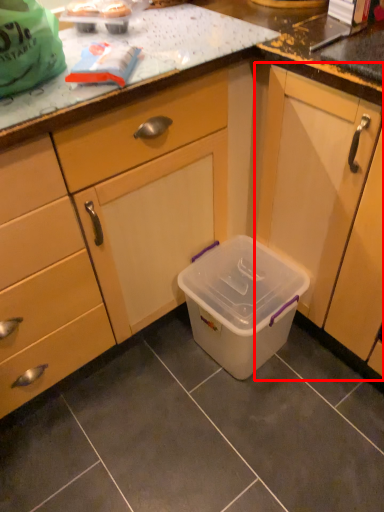
Question: From the image's perspective, what is the correct spatial positioning of cabinetry (annotated by the red box) in reference to storage box?

Choices:
 (A) above
 (B) below

Answer: (A)